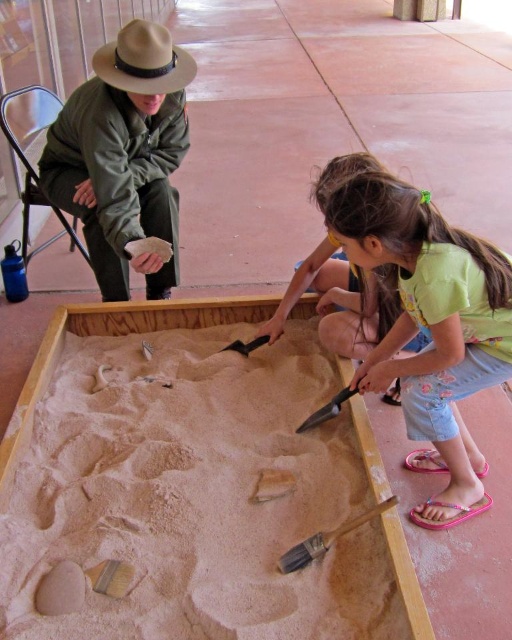
Is beige felt cowboy hat at upper left to the left of metallic silver shovel at lower center from the viewer's perspective?

Indeed, beige felt cowboy hat at upper left is positioned on the left side of metallic silver shovel at lower center.

Is point (123, 32) in front of point (296, 428)?

No.

Identify the location of beige felt cowboy hat at upper left. The image size is (512, 640). (143, 60).

At what (x,y) coordinates should I click in order to perform the action: click on beige felt cowboy hat at upper left. Please return your answer as a coordinate pair (x, y). The image size is (512, 640). Looking at the image, I should click on point(143,60).

Which of these two, beige felt cowboy hat at upper left or wooden shovel at center, stands taller?

With more height is beige felt cowboy hat at upper left.

Which is behind, point (178, 90) or point (310, 550)?

Point (178, 90)

This screenshot has width=512, height=640. In order to click on beige felt cowboy hat at upper left in this screenshot , I will do `click(143, 60)`.

From the picture: Which is more to the left, fine-grained sand at center or green cotton shirt at center?

fine-grained sand at center

Is fine-grained sand at center positioned before green cotton shirt at center?

Yes, fine-grained sand at center is closer to the viewer.

This screenshot has height=640, width=512. What do you see at coordinates (194, 496) in the screenshot?
I see `fine-grained sand at center` at bounding box center [194, 496].

Where is `fine-grained sand at center`? fine-grained sand at center is located at coordinates (194, 496).